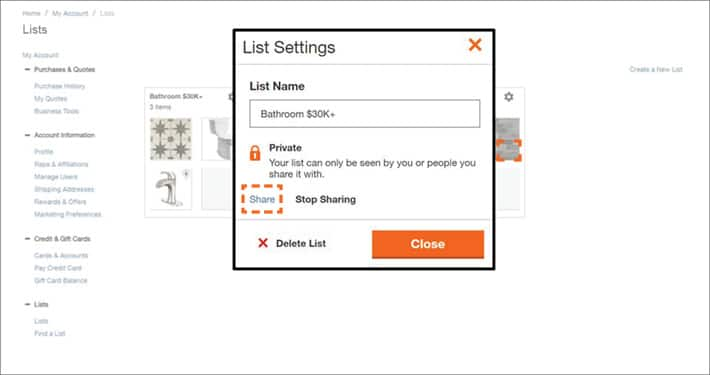
Locate an element on the screen. The height and width of the screenshot is (375, 710). toilets is located at coordinates (224, 148).